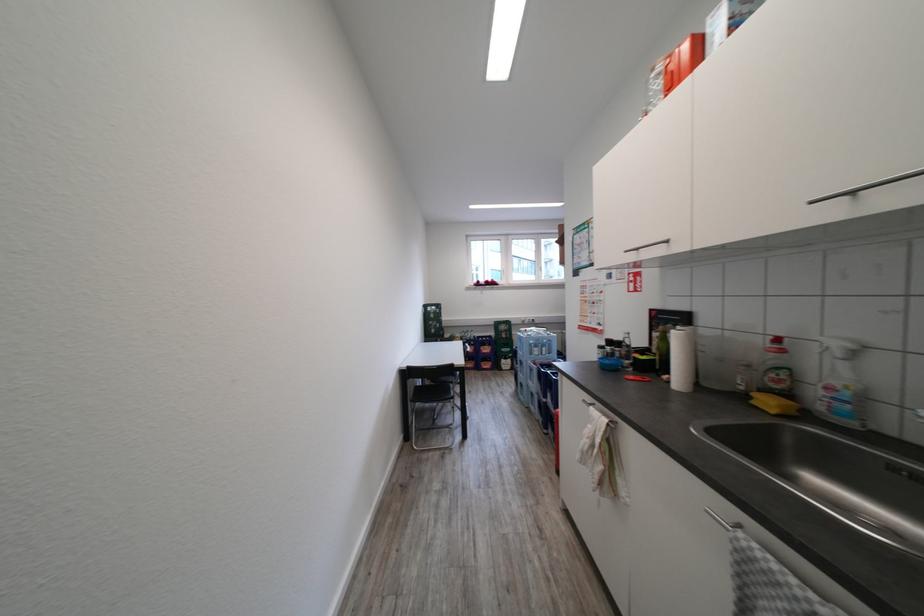
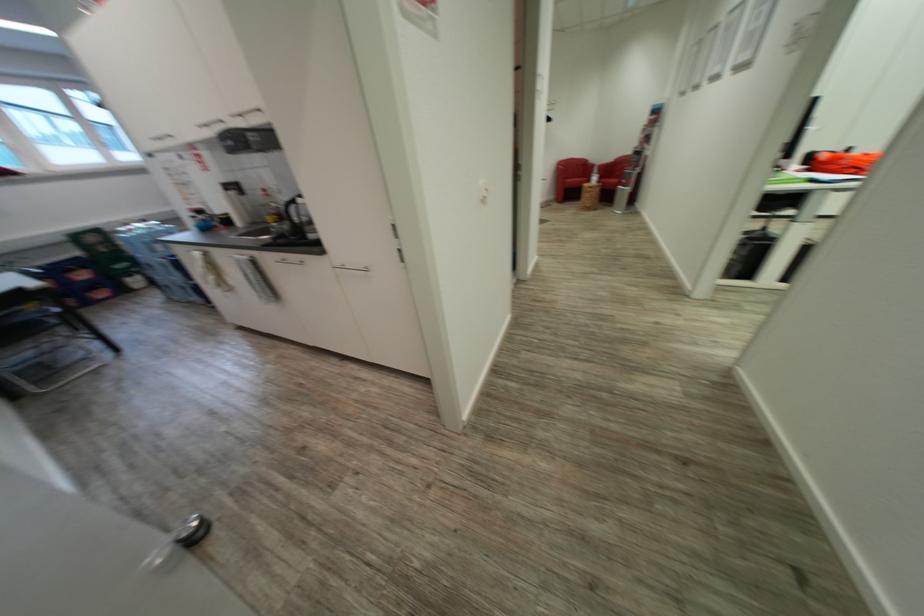
In the second image, find the point that corresponds to (x=811, y=201) in the first image.

(198, 127)